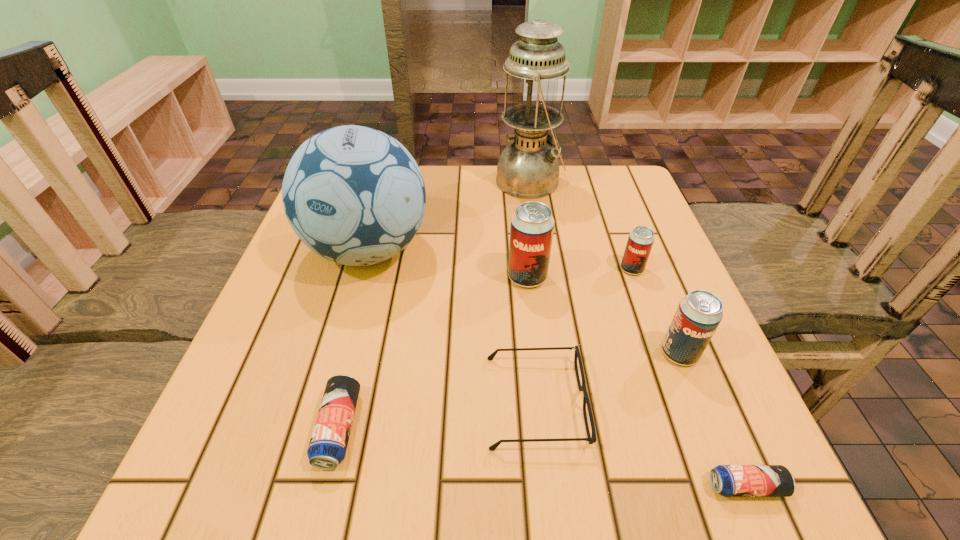
Locate an element on the screen. This screenshot has height=540, width=960. free space at the near edge is located at coordinates [x=483, y=446].

Identify the location of free space at the left edge of the desktop. This screenshot has height=540, width=960. (354, 274).

Find the location of `free space at the right edge`. free space at the right edge is located at coordinates (632, 334).

Where is `vacant space at the far right corner`? vacant space at the far right corner is located at coordinates (602, 169).

The width and height of the screenshot is (960, 540). Identify the location of free spot between the nearer blue beer can and the oil lamp. (637, 334).

Where is `free spot between the spectacles and the third farthest beer can`? This screenshot has height=540, width=960. free spot between the spectacles and the third farthest beer can is located at coordinates (608, 377).

Locate an element on the screen. This screenshot has width=960, height=540. free spot between the right blue beer can and the fourth shortest object is located at coordinates (689, 377).

At what (x,y) coordinates should I click in order to perform the action: click on free spot between the leftmost red beer can and the right blue beer can. Please return your answer as a coordinate pair (x, y). Looking at the image, I should click on point(636,382).

Where is `free area in between the tallest beer can and the second smallest red beer can`? Image resolution: width=960 pixels, height=540 pixels. free area in between the tallest beer can and the second smallest red beer can is located at coordinates (603, 315).

Locate an element on the screen. The height and width of the screenshot is (540, 960). free space between the smallest red beer can and the oil lamp is located at coordinates (581, 225).